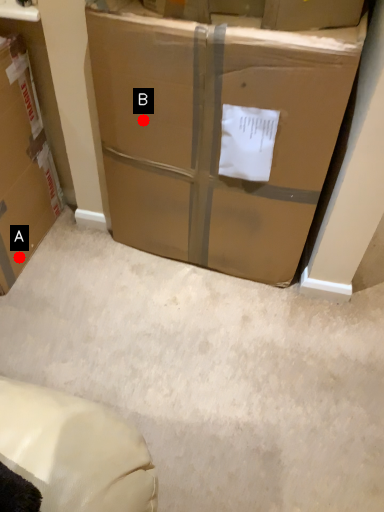
Question: Two points are circled on the image, labeled by A and B beside each circle. Which of the following is the closest to the observer?

Choices:
 (A) A is closer
 (B) B is closer

Answer: (B)